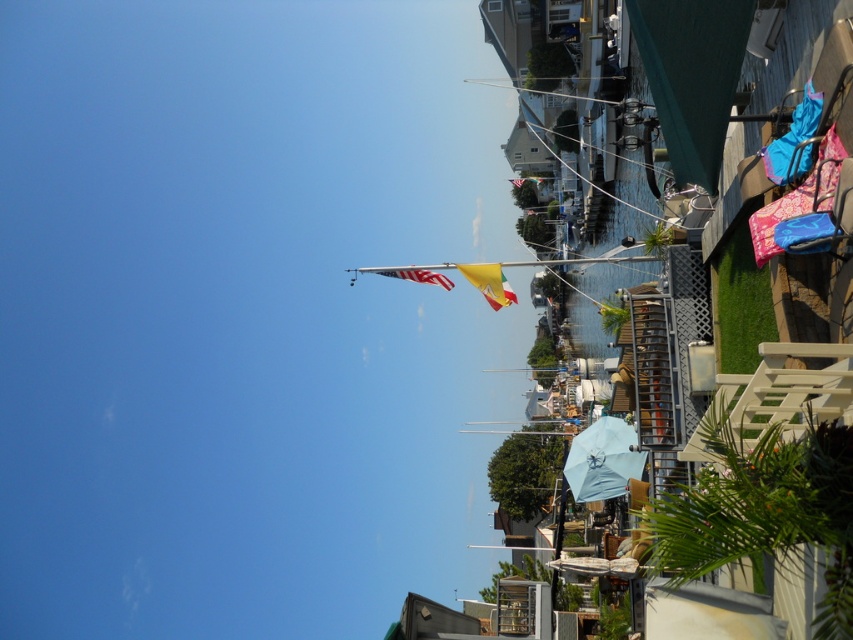
Which is more to the right, light blue fabric umbrella at center or yellow fabric flag at center?

From the viewer's perspective, light blue fabric umbrella at center appears more on the right side.

Is light blue fabric umbrella at center above yellow fabric flag at center?

No, light blue fabric umbrella at center is not above yellow fabric flag at center.

Locate an element on the screen. The image size is (853, 640). light blue fabric umbrella at center is located at coordinates (602, 460).

Which is behind, point (502, 291) or point (419, 269)?

Point (502, 291)

Is yellow fabric flag at center positioned at the back of american flag at center?

That is True.

Which is in front, point (463, 273) or point (438, 284)?

Positioned in front is point (463, 273).

You are a GUI agent. You are given a task and a screenshot of the screen. Output one action in this format:
    pyautogui.click(x=<x>, y=<y>)
    Task: Click on the yellow fabric flag at center
    The width and height of the screenshot is (853, 640).
    Given the screenshot: What is the action you would take?
    pyautogui.click(x=489, y=284)

Does light blue fabric umbrella at center have a lesser height compared to american flag at center?

Incorrect, light blue fabric umbrella at center's height does not fall short of american flag at center's.

Is point (585, 460) closer to camera compared to point (404, 273)?

No, it is behind (404, 273).

Locate an element on the screen. The image size is (853, 640). light blue fabric umbrella at center is located at coordinates (602, 460).

This screenshot has width=853, height=640. I want to click on light blue fabric umbrella at center, so click(602, 460).